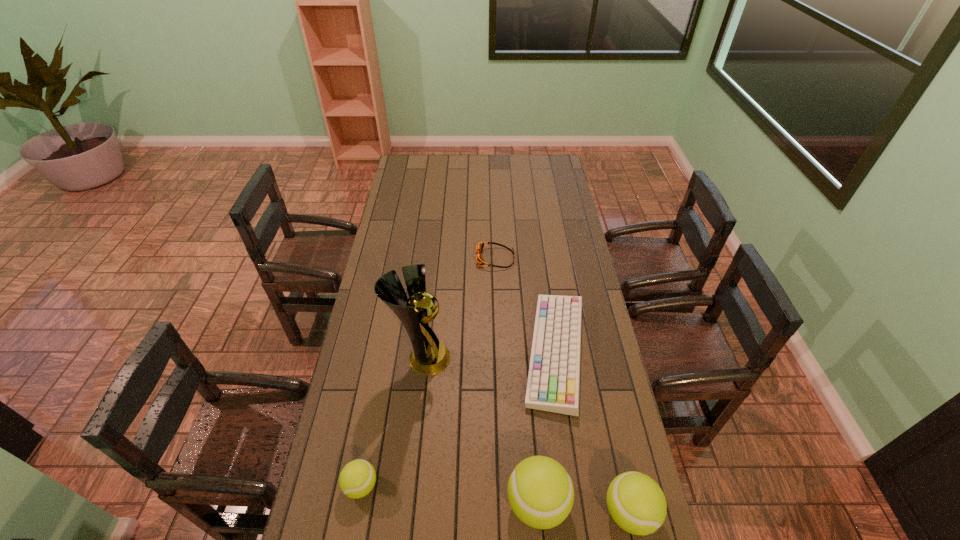
Choose which tennis ball is the second nearest neighbor to the second tennis ball from right to left. Please provide its 2D coordinates. Your answer should be formatted as a tuple, i.e. [(x, y)], where the tuple contains the x and y coordinates of a point satisfying the conditions above.

[(357, 479)]

What are the coordinates of `free space that satisfies the following two spatial constraints: 1. on the front side of the fifth tallest object; 2. at the front of the award, where the globe is visible` in the screenshot? It's located at (557, 358).

Locate an element on the screen. The width and height of the screenshot is (960, 540). free space in the image that satisfies the following two spatial constraints: 1. on the back side of the second shortest object; 2. on the left side of the second tennis ball from left to right is located at coordinates pyautogui.click(x=524, y=352).

The image size is (960, 540). Find the location of `vacant point that satisfies the following two spatial constraints: 1. with the lenses facing forward on the farthest object; 2. on the right side of the second tennis ball from left to right`. vacant point that satisfies the following two spatial constraints: 1. with the lenses facing forward on the farthest object; 2. on the right side of the second tennis ball from left to right is located at coordinates (504, 503).

Identify the location of free space that satisfies the following two spatial constraints: 1. on the back side of the fifth tallest object; 2. on the right side of the second tennis ball from left to right. (524, 352).

Image resolution: width=960 pixels, height=540 pixels. I want to click on vacant space that satisfies the following two spatial constraints: 1. on the back side of the second tennis ball from right to left; 2. at the front of the award, where the globe is visible, so click(525, 358).

Identify the location of vacant space that satisfies the following two spatial constraints: 1. with the lenses facing forward on the farthest object; 2. on the right side of the computer keyboard. This screenshot has width=960, height=540. (499, 352).